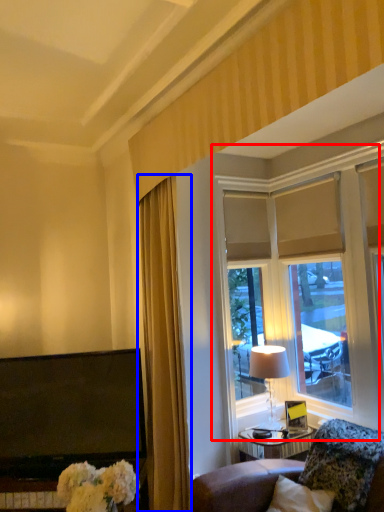
Question: Which object is further to the camera taking this photo, window (highlighted by a red box) or curtain (highlighted by a blue box)?

Choices:
 (A) window
 (B) curtain

Answer: (A)